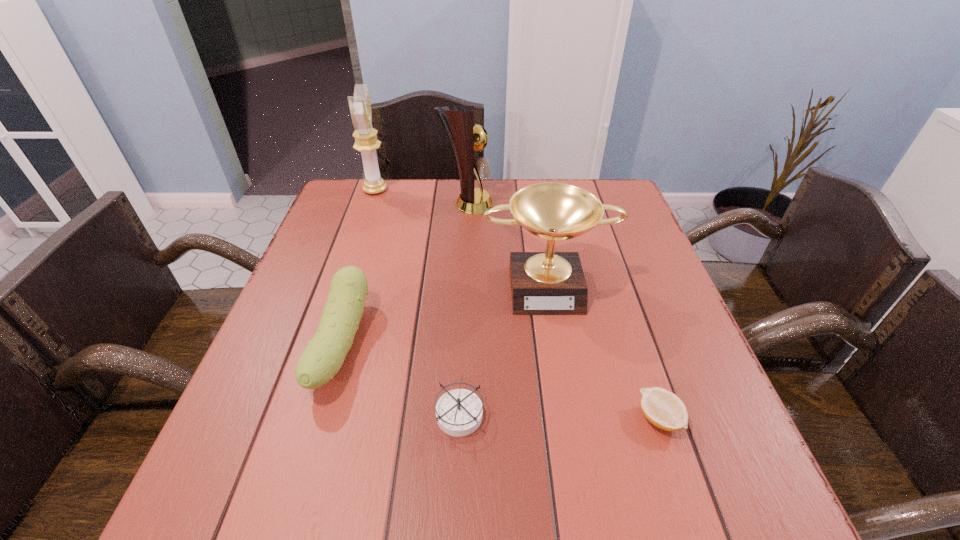
Where is `the fourth closest object to the lemon`? The image size is (960, 540). the fourth closest object to the lemon is located at coordinates (459, 124).

At what (x,y) coordinates should I click in order to perform the action: click on award that is the closest to the lemon. Please return your answer as a coordinate pair (x, y). Looking at the image, I should click on (542, 283).

Identify which award is located as the third nearest to the compass. Please provide its 2D coordinates. Your answer should be formatted as a tuple, i.e. [(x, y)], where the tuple contains the x and y coordinates of a point satisfying the conditions above.

[(366, 142)]

You are a GUI agent. You are given a task and a screenshot of the screen. Output one action in this format:
    pyautogui.click(x=<x>, y=<y>)
    Task: Click on the vacant space that satisfies the following two spatial constraints: 1. on the front-facing side of the leftmost award; 2. on the right side of the cucumber
    This screenshot has width=960, height=540.
    Given the screenshot: What is the action you would take?
    pyautogui.click(x=324, y=345)

Locate an element on the screen. The width and height of the screenshot is (960, 540). vacant area that satisfies the following two spatial constraints: 1. on the front-facing side of the lemon; 2. on the left side of the leftmost award is located at coordinates (299, 418).

Image resolution: width=960 pixels, height=540 pixels. Find the location of `vacant point that satisfies the following two spatial constraints: 1. on the front-facing side of the shortest object; 2. on the left side of the leftmost award`. vacant point that satisfies the following two spatial constraints: 1. on the front-facing side of the shortest object; 2. on the left side of the leftmost award is located at coordinates pyautogui.click(x=299, y=418).

The width and height of the screenshot is (960, 540). What are the coordinates of `free location that satisfies the following two spatial constraints: 1. on the front-facing side of the leftmost award; 2. on the left side of the shortest object` in the screenshot? It's located at (299, 418).

Identify the location of vacant position in the image that satisfies the following two spatial constraints: 1. on the front-facing side of the compass; 2. on the right side of the leftmost award. This screenshot has height=540, width=960. (300, 413).